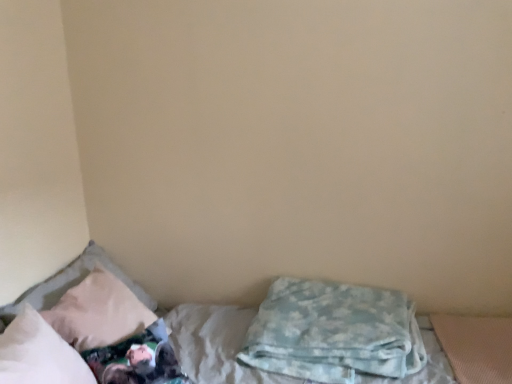
I want to click on blue soft blanket at lower right, acting as the 3th pillow starting from the left, so click(x=333, y=332).

Describe the element at coordinates (333, 332) in the screenshot. I see `blue soft blanket at lower right, acting as the 3th pillow starting from the left` at that location.

Find the location of `white soft bed at lower left`. white soft bed at lower left is located at coordinates (215, 344).

Identify the location of white soft pillow at left, arranged as the first pillow when viewed from the left. (39, 353).

Is white soft pillow at left, arranged as the first pillow when viewed from the left, facing away from white soft bed at lower left?

Yes, white soft bed at lower left is at the back of white soft pillow at left, arranged as the first pillow when viewed from the left.

Consider the image. From the image's perspective, is white soft pillow at left, arranged as the first pillow when viewed from the left, on white soft bed at lower left?

Yes, from the image's perspective, white soft pillow at left, arranged as the first pillow when viewed from the left, is on top of white soft bed at lower left.

How many degrees apart are the facing directions of white soft pillow at left, arranged as the first pillow when viewed from the left, and white soft bed at lower left?

The angular difference between white soft pillow at left, arranged as the first pillow when viewed from the left, and white soft bed at lower left is 89.4 degrees.

Considering the relative sizes of white soft pillow at left, arranged as the first pillow when viewed from the left, and white soft bed at lower left in the image provided, is white soft pillow at left, arranged as the first pillow when viewed from the left, taller than white soft bed at lower left?

In fact, white soft pillow at left, arranged as the first pillow when viewed from the left, may be shorter than white soft bed at lower left.

Which point is more distant from viewer, [69,273] or [297,345]?

Positioned behind is point [69,273].

Which object is closer to the camera taking this photo, beige fabric pillow at left, which appears as the second pillow when viewed from the right, or blue soft blanket at lower right, acting as the 3th pillow starting from the left?

blue soft blanket at lower right, acting as the 3th pillow starting from the left, is more forward.

You are a GUI agent. You are given a task and a screenshot of the screen. Output one action in this format:
    pyautogui.click(x=<x>, y=<y>)
    Task: Click on the pillow on the right of beige fabric pillow at left, which appears as the second pillow when viewed from the right
    The height and width of the screenshot is (384, 512).
    Given the screenshot: What is the action you would take?
    pyautogui.click(x=333, y=332)

From the image's perspective, which is below, beige fabric pillow at left, positioned as the second pillow in left-to-right order, or blue soft blanket at lower right, acting as the 3th pillow starting from the left?

blue soft blanket at lower right, acting as the 3th pillow starting from the left, from the image's perspective.

Considering the sizes of white soft pillow at left, which is the third pillow from right to left, and blue soft blanket at lower right, placed as the 1th pillow when sorted from right to left, in the image, is white soft pillow at left, which is the third pillow from right to left, wider or thinner than blue soft blanket at lower right, placed as the 1th pillow when sorted from right to left,?

white soft pillow at left, which is the third pillow from right to left, is thinner than blue soft blanket at lower right, placed as the 1th pillow when sorted from right to left.

Measure the distance between white soft pillow at left, which is the third pillow from right to left, and blue soft blanket at lower right, acting as the 3th pillow starting from the left.

The distance of white soft pillow at left, which is the third pillow from right to left, from blue soft blanket at lower right, acting as the 3th pillow starting from the left, is 31.03 inches.

Can you confirm if white soft pillow at left, arranged as the first pillow when viewed from the left, is smaller than blue soft blanket at lower right, acting as the 3th pillow starting from the left?

Indeed, white soft pillow at left, arranged as the first pillow when viewed from the left, has a smaller size compared to blue soft blanket at lower right, acting as the 3th pillow starting from the left.

Between point (12, 323) and point (407, 365), which one is positioned in front?

The point (12, 323) is in front.

Do you think white soft bed at lower left is within blue soft blanket at lower right, placed as the 1th pillow when sorted from right to left, or outside of it?

white soft bed at lower left is not enclosed by blue soft blanket at lower right, placed as the 1th pillow when sorted from right to left.

Considering the sizes of objects white soft bed at lower left and blue soft blanket at lower right, acting as the 3th pillow starting from the left, in the image provided, who is shorter, white soft bed at lower left or blue soft blanket at lower right, acting as the 3th pillow starting from the left,?

With less height is blue soft blanket at lower right, acting as the 3th pillow starting from the left.

Is point (175, 350) more distant than point (287, 299)?

No, (175, 350) is in front of (287, 299).

From a real-world perspective, which is physically above, blue soft blanket at lower right, placed as the 1th pillow when sorted from right to left, or white soft pillow at left, arranged as the first pillow when viewed from the left?

From a 3D spatial view, white soft pillow at left, arranged as the first pillow when viewed from the left, is above.

Would you say blue soft blanket at lower right, acting as the 3th pillow starting from the left, is outside white soft pillow at left, which is the third pillow from right to left?

Yes.

Between blue soft blanket at lower right, acting as the 3th pillow starting from the left, and white soft pillow at left, which is the third pillow from right to left, which one has smaller width?

white soft pillow at left, which is the third pillow from right to left, is thinner.

Who is more distant, blue soft blanket at lower right, acting as the 3th pillow starting from the left, or white soft pillow at left, arranged as the first pillow when viewed from the left?

Positioned behind is blue soft blanket at lower right, acting as the 3th pillow starting from the left.

Is blue soft blanket at lower right, acting as the 3th pillow starting from the left, facing towards white soft bed at lower left?

Yes.

Considering the sizes of blue soft blanket at lower right, acting as the 3th pillow starting from the left, and white soft bed at lower left in the image, is blue soft blanket at lower right, acting as the 3th pillow starting from the left, wider or thinner than white soft bed at lower left?

Clearly, blue soft blanket at lower right, acting as the 3th pillow starting from the left, has less width compared to white soft bed at lower left.

Image resolution: width=512 pixels, height=384 pixels. What are the coordinates of `pillow that is the 1st object above the white soft bed at lower left (from a real-world perspective)` in the screenshot? It's located at (333, 332).

How different are the orientations of blue soft blanket at lower right, acting as the 3th pillow starting from the left, and beige fabric pillow at left, which appears as the second pillow when viewed from the right, in degrees?

The facing directions of blue soft blanket at lower right, acting as the 3th pillow starting from the left, and beige fabric pillow at left, which appears as the second pillow when viewed from the right, are 1.36 degrees apart.

Is blue soft blanket at lower right, acting as the 3th pillow starting from the left, outside of beige fabric pillow at left, positioned as the second pillow in left-to-right order?

Yes.

Is blue soft blanket at lower right, placed as the 1th pillow when sorted from right to left, not near beige fabric pillow at left, which appears as the second pillow when viewed from the right?

No, blue soft blanket at lower right, placed as the 1th pillow when sorted from right to left, is not far away from beige fabric pillow at left, which appears as the second pillow when viewed from the right.

The image size is (512, 384). I want to click on pillow that is the 2nd one when counting leftward from the white soft bed at lower left, so click(x=39, y=353).

In the image, there is a blue soft blanket at lower right, placed as the 1th pillow when sorted from right to left. At what (x,y) coordinates should I click in order to perform the action: click on pillow above it (from the image's perspective). Please return your answer as a coordinate pair (x, y). The image size is (512, 384). Looking at the image, I should click on (73, 283).

Considering their positions, is white soft pillow at left, arranged as the first pillow when viewed from the left, positioned closer to blue soft blanket at lower right, acting as the 3th pillow starting from the left, than beige fabric pillow at left, positioned as the second pillow in left-to-right order?

white soft pillow at left, arranged as the first pillow when viewed from the left, is closer to blue soft blanket at lower right, acting as the 3th pillow starting from the left.

When comparing their distances from blue soft blanket at lower right, placed as the 1th pillow when sorted from right to left, does white soft pillow at left, arranged as the first pillow when viewed from the left, or white soft bed at lower left seem closer?

Based on the image, white soft bed at lower left appears to be nearer to blue soft blanket at lower right, placed as the 1th pillow when sorted from right to left.

Estimate the real-world distances between objects in this image. Which object is further from white soft pillow at left, which is the third pillow from right to left, white soft bed at lower left or beige fabric pillow at left, positioned as the second pillow in left-to-right order?

Based on the image, beige fabric pillow at left, positioned as the second pillow in left-to-right order, appears to be further to white soft pillow at left, which is the third pillow from right to left.

When comparing their distances from blue soft blanket at lower right, placed as the 1th pillow when sorted from right to left, does white soft bed at lower left or white soft pillow at left, which is the third pillow from right to left, seem closer?

Based on the image, white soft bed at lower left appears to be nearer to blue soft blanket at lower right, placed as the 1th pillow when sorted from right to left.

Based on their spatial positions, is beige fabric pillow at left, which appears as the second pillow when viewed from the right, or blue soft blanket at lower right, placed as the 1th pillow when sorted from right to left, further from white soft pillow at left, which is the third pillow from right to left?

blue soft blanket at lower right, placed as the 1th pillow when sorted from right to left.

Based on the photo, based on their spatial positions, is blue soft blanket at lower right, acting as the 3th pillow starting from the left, or white soft pillow at left, arranged as the first pillow when viewed from the left, further from beige fabric pillow at left, positioned as the second pillow in left-to-right order?

Based on the image, blue soft blanket at lower right, acting as the 3th pillow starting from the left, appears to be further to beige fabric pillow at left, positioned as the second pillow in left-to-right order.

Based on their spatial positions, is beige fabric pillow at left, positioned as the second pillow in left-to-right order, or white soft pillow at left, which is the third pillow from right to left, closer to white soft bed at lower left?

Among the two, beige fabric pillow at left, positioned as the second pillow in left-to-right order, is located nearer to white soft bed at lower left.

Looking at this image, considering their positions, is blue soft blanket at lower right, acting as the 3th pillow starting from the left, positioned further to white soft bed at lower left than beige fabric pillow at left, which appears as the second pillow when viewed from the right?

blue soft blanket at lower right, acting as the 3th pillow starting from the left, is positioned further to the anchor white soft bed at lower left.

Where is `bed between beige fabric pillow at left, which appears as the second pillow when viewed from the right, and blue soft blanket at lower right, placed as the 1th pillow when sorted from right to left`? bed between beige fabric pillow at left, which appears as the second pillow when viewed from the right, and blue soft blanket at lower right, placed as the 1th pillow when sorted from right to left is located at coordinates (215, 344).

Find the location of `pillow between white soft pillow at left, arranged as the first pillow when viewed from the left, and white soft bed at lower left from left to right`. pillow between white soft pillow at left, arranged as the first pillow when viewed from the left, and white soft bed at lower left from left to right is located at coordinates (73, 283).

The height and width of the screenshot is (384, 512). What are the coordinates of `bed between white soft pillow at left, which is the third pillow from right to left, and blue soft blanket at lower right, placed as the 1th pillow when sorted from right to left` in the screenshot? It's located at (215, 344).

Identify the location of pillow situated between white soft pillow at left, which is the third pillow from right to left, and blue soft blanket at lower right, acting as the 3th pillow starting from the left, from left to right. This screenshot has height=384, width=512. (73, 283).